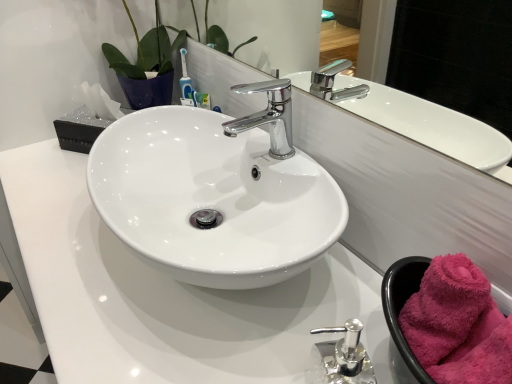
What do you see at coordinates (433, 126) in the screenshot? Image resolution: width=512 pixels, height=384 pixels. I see `glossy ceramic mirror at upper center` at bounding box center [433, 126].

Describe the element at coordinates (454, 323) in the screenshot. The image size is (512, 384). I see `pink fluffy bath towel at lower right` at that location.

At what (x,y) coordinates should I click in order to perform the action: click on glossy ceramic mirror at upper center. Please return your answer as a coordinate pair (x, y). The height and width of the screenshot is (384, 512). Looking at the image, I should click on tap(433, 126).

Based on the photo, is glossy ceramic mirror at upper center with chrome/metallic faucet at center?

No, glossy ceramic mirror at upper center is not next to chrome/metallic faucet at center.

Based on the photo, is the depth of glossy ceramic mirror at upper center less than that of chrome/metallic faucet at center?

Yes, the depth of glossy ceramic mirror at upper center is less than that of chrome/metallic faucet at center.

Is glossy ceramic mirror at upper center taller than chrome/metallic faucet at center?

Indeed, glossy ceramic mirror at upper center has a greater height compared to chrome/metallic faucet at center.

Considering the relative positions of pink fluffy bath towel at lower right and chrome/metallic faucet at center in the image provided, is pink fluffy bath towel at lower right to the left of chrome/metallic faucet at center from the viewer's perspective?

No, pink fluffy bath towel at lower right is not to the left of chrome/metallic faucet at center.

At what (x,y) coordinates should I click in order to perform the action: click on bath towel below the chrome/metallic faucet at center (from a real-world perspective). Please return your answer as a coordinate pair (x, y). This screenshot has width=512, height=384. Looking at the image, I should click on (454, 323).

Is pink fluffy bath towel at lower right wider than chrome/metallic faucet at center?

In fact, pink fluffy bath towel at lower right might be narrower than chrome/metallic faucet at center.

Is pink fluffy bath towel at lower right not within chrome/metallic faucet at center?

Yes, pink fluffy bath towel at lower right is located beyond the bounds of chrome/metallic faucet at center.

Image resolution: width=512 pixels, height=384 pixels. I want to click on bath towel in front of the chrome/metallic faucet at center, so click(454, 323).

Considering the relative sizes of chrome/metallic faucet at center and pink fluffy bath towel at lower right in the image provided, is chrome/metallic faucet at center taller than pink fluffy bath towel at lower right?

Yes.

How much distance is there between chrome/metallic faucet at center and pink fluffy bath towel at lower right?

chrome/metallic faucet at center and pink fluffy bath towel at lower right are 16.02 inches apart from each other.

How different are the orientations of chrome/metallic faucet at center and pink fluffy bath towel at lower right in degrees?

The angle between the facing direction of chrome/metallic faucet at center and the facing direction of pink fluffy bath towel at lower right is 0.00334 degrees.

Considering the sizes of white glossy counter top at center and chrome/metallic faucet at center in the image, is white glossy counter top at center wider or thinner than chrome/metallic faucet at center?

Clearly, white glossy counter top at center has more width compared to chrome/metallic faucet at center.

From the image's perspective, is white glossy counter top at center located above or below chrome/metallic faucet at center?

Based on their image positions, white glossy counter top at center is located beneath chrome/metallic faucet at center.

Between white glossy counter top at center and chrome/metallic faucet at center, which one appears on the right side from the viewer's perspective?

Positioned to the right is chrome/metallic faucet at center.

What's the angular difference between white glossy counter top at center and chrome/metallic faucet at center's facing directions?

0.105 degrees.

Is white glossy counter top at center at the back of glossy ceramic mirror at upper center?

No, glossy ceramic mirror at upper center is not facing away from white glossy counter top at center.

Which is nearer, (263, 10) or (100, 263)?

Point (263, 10).

Would you consider glossy ceramic mirror at upper center to be distant from white glossy counter top at center?

That's not correct — glossy ceramic mirror at upper center is a little close to white glossy counter top at center.

From the image's perspective, who appears lower, glossy ceramic mirror at upper center or white glossy counter top at center?

white glossy counter top at center appears lower in the image.

Is white glossy counter top at center facing towards pink fluffy bath towel at lower right?

No, white glossy counter top at center is not facing towards pink fluffy bath towel at lower right.

From a real-world perspective, relative to pink fluffy bath towel at lower right, is white glossy counter top at center vertically above or below?

From a real-world perspective, white glossy counter top at center is physically below pink fluffy bath towel at lower right.

Is point (182, 371) closer to viewer compared to point (400, 299)?

Yes, point (182, 371) is closer to viewer.

Who is bigger, white glossy counter top at center or pink fluffy bath towel at lower right?

Bigger between the two is white glossy counter top at center.

Is pink fluffy bath towel at lower right thinner than white glossy counter top at center?

Indeed, pink fluffy bath towel at lower right has a lesser width compared to white glossy counter top at center.

Is pink fluffy bath towel at lower right facing towards white glossy counter top at center?

No, pink fluffy bath towel at lower right is not turned towards white glossy counter top at center.

From a real-world perspective, is pink fluffy bath towel at lower right below white glossy counter top at center?

Actually, pink fluffy bath towel at lower right is physically above white glossy counter top at center in the real world.

Which is behind, pink fluffy bath towel at lower right or white glossy counter top at center?

pink fluffy bath towel at lower right.

Identify the location of tap that is on the left side of glossy ceramic mirror at upper center. This screenshot has width=512, height=384. (268, 116).

The height and width of the screenshot is (384, 512). I want to click on tap above the pink fluffy bath towel at lower right (from the image's perspective), so click(x=268, y=116).

Which object lies nearer to the anchor point chrome/metallic faucet at center, white glossy counter top at center or pink fluffy bath towel at lower right?

Among the two, white glossy counter top at center is located nearer to chrome/metallic faucet at center.

Based on their spatial positions, is white glossy counter top at center or chrome/metallic faucet at center closer to pink fluffy bath towel at lower right?

The object closer to pink fluffy bath towel at lower right is white glossy counter top at center.

Which object lies further to the anchor point glossy ceramic mirror at upper center, pink fluffy bath towel at lower right or white glossy counter top at center?

pink fluffy bath towel at lower right.

When comparing their distances from white glossy counter top at center, does chrome/metallic faucet at center or pink fluffy bath towel at lower right seem further?

chrome/metallic faucet at center lies further to white glossy counter top at center than the other object.

When comparing their distances from white glossy counter top at center, does pink fluffy bath towel at lower right or chrome/metallic faucet at center seem further?

The object further to white glossy counter top at center is chrome/metallic faucet at center.

Which object lies further to the anchor point white glossy counter top at center, pink fluffy bath towel at lower right or glossy ceramic mirror at upper center?

The object further to white glossy counter top at center is glossy ceramic mirror at upper center.

Which object lies further to the anchor point pink fluffy bath towel at lower right, chrome/metallic faucet at center or white glossy counter top at center?

chrome/metallic faucet at center.

Considering their positions, is glossy ceramic mirror at upper center positioned closer to chrome/metallic faucet at center than pink fluffy bath towel at lower right?

The object closer to chrome/metallic faucet at center is glossy ceramic mirror at upper center.

Locate an element on the screen. tap between glossy ceramic mirror at upper center and white glossy counter top at center in the up-down direction is located at coordinates (268, 116).

Identify the location of tap between glossy ceramic mirror at upper center and pink fluffy bath towel at lower right in the vertical direction. This screenshot has width=512, height=384. (268, 116).

The image size is (512, 384). What are the coordinates of `bath towel that lies between glossy ceramic mirror at upper center and white glossy counter top at center from top to bottom` in the screenshot? It's located at (454, 323).

The width and height of the screenshot is (512, 384). Find the location of `tap between white glossy counter top at center and pink fluffy bath towel at lower right in the horizontal direction`. tap between white glossy counter top at center and pink fluffy bath towel at lower right in the horizontal direction is located at coordinates (268, 116).